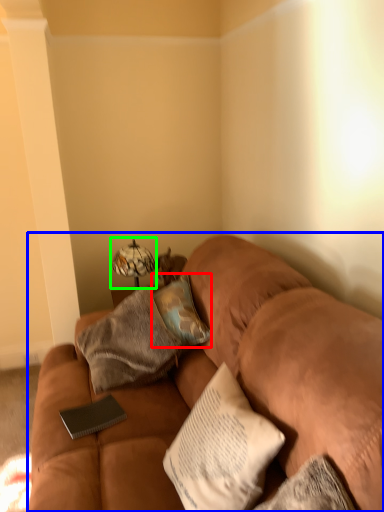
Question: Which object is positioned farthest from pillow (highlighted by a red box)? Select from studio couch (highlighted by a blue box) and table lamp (highlighted by a green box).

Choices:
 (A) studio couch
 (B) table lamp

Answer: (B)